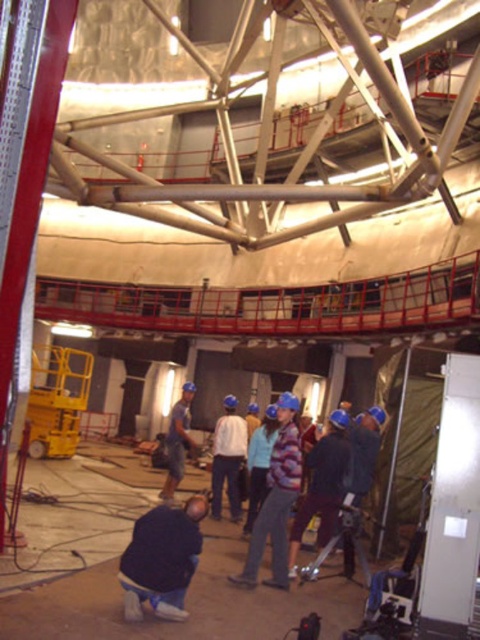
Question: Is dark blue jeans at lower center further to camera compared to white matte shirt at center?

Choices:
 (A) yes
 (B) no

Answer: (B)

Question: Which point is closer to the camera taking this photo?

Choices:
 (A) pos(142,592)
 (B) pos(226,429)

Answer: (A)

Question: Considering the relative positions of white matte shirt at center and blue hard hat at center in the image provided, where is white matte shirt at center located with respect to blue hard hat at center?

Choices:
 (A) right
 (B) left

Answer: (A)

Question: Is white matte shirt at center thinner than blue hard hat at center?

Choices:
 (A) no
 (B) yes

Answer: (B)

Question: Which point is closer to the camera?

Choices:
 (A) (232, 440)
 (B) (179, 609)

Answer: (B)

Question: Which point is closer to the camera taking this photo?

Choices:
 (A) (211, 477)
 (B) (152, 516)
 (C) (180, 458)

Answer: (B)